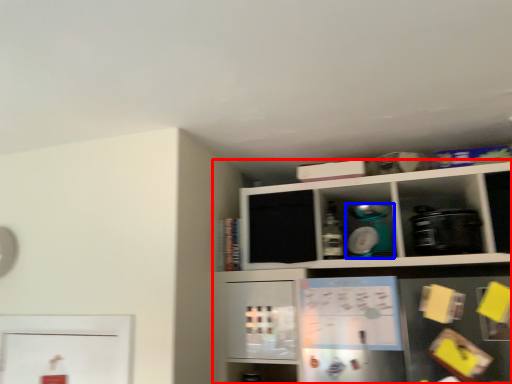
Question: Which object appears closest to the camera in this image, shelf (highlighted by a red box) or appliance (highlighted by a blue box)?

Choices:
 (A) shelf
 (B) appliance

Answer: (A)